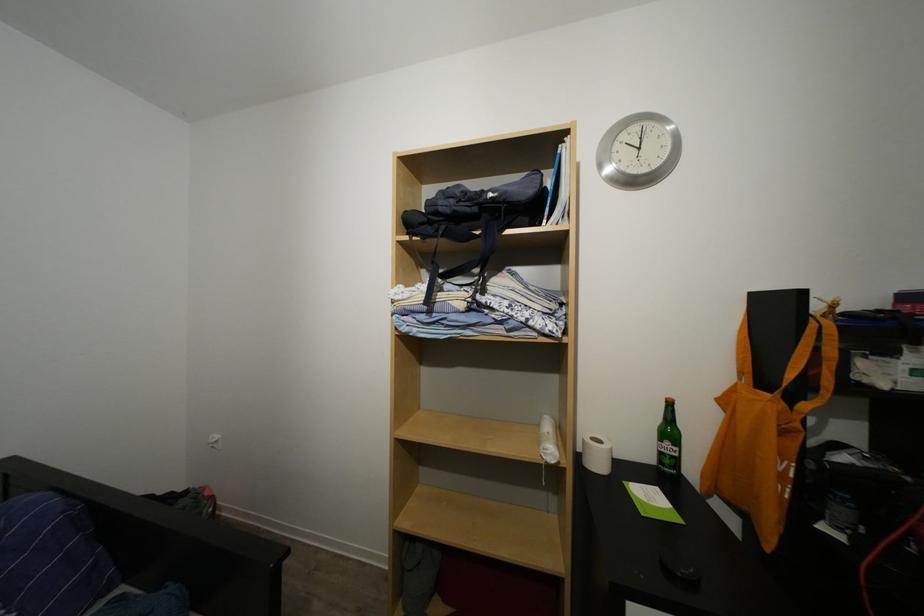
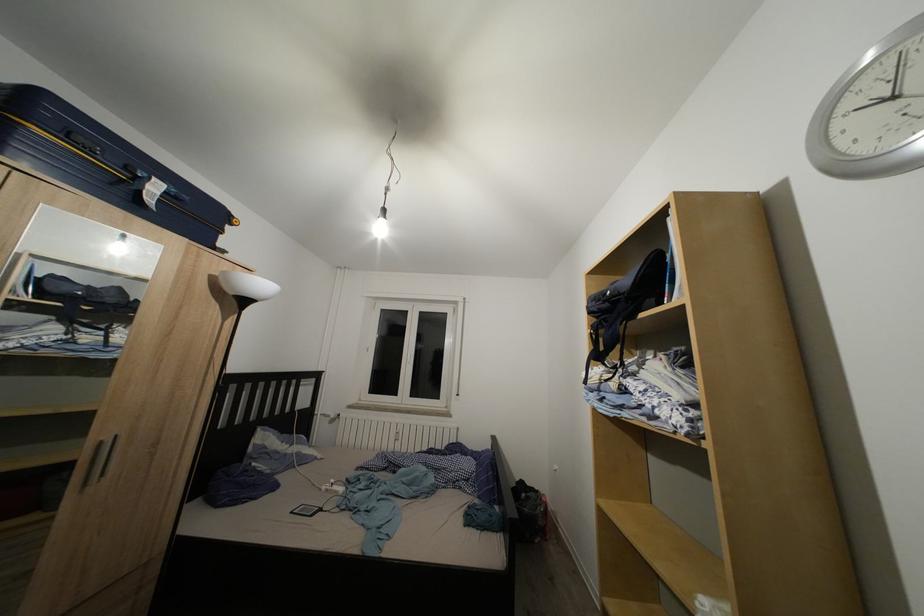
Question: The images are taken continuously from a first-person perspective. In which direction is your viewpoint rotating?

Choices:
 (A) Left
 (B) Right
 (C) Up
 (D) Down

Answer: (A)